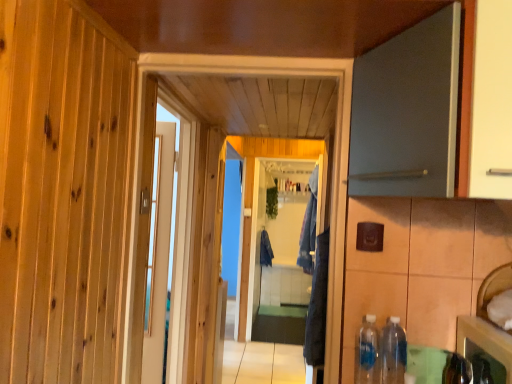
Question: Considering the relative sizes of shiny metallic cabinet at lower right and clear plastic bottle at lower right, the second bottle positioned from the left, in the image provided, is shiny metallic cabinet at lower right bigger than clear plastic bottle at lower right, the second bottle positioned from the left,?

Choices:
 (A) yes
 (B) no

Answer: (A)

Question: Does shiny metallic cabinet at lower right contain clear plastic bottle at lower right, which is the 1th bottle from right to left?

Choices:
 (A) no
 (B) yes

Answer: (A)

Question: Is shiny metallic cabinet at lower right far from clear plastic bottle at lower right, which is the 1th bottle from right to left?

Choices:
 (A) yes
 (B) no

Answer: (B)

Question: Can you confirm if shiny metallic cabinet at lower right is wider than clear plastic bottle at lower right, which is the 1th bottle from right to left?

Choices:
 (A) no
 (B) yes

Answer: (B)

Question: From the image's perspective, is shiny metallic cabinet at lower right above clear plastic bottle at lower right, which is the 1th bottle from right to left?

Choices:
 (A) no
 (B) yes

Answer: (B)

Question: Based on their positions, is clear plastic bottle at lower right, which is the 1th bottle from right to left, located to the left or right of clear glass screen door at center?

Choices:
 (A) left
 (B) right

Answer: (B)

Question: Is point (394, 352) positioned closer to the camera than point (271, 324)?

Choices:
 (A) farther
 (B) closer

Answer: (B)

Question: Considering their positions, is clear plastic bottle at lower right, which is the 1th bottle from right to left, located in front of or behind clear glass screen door at center?

Choices:
 (A) front
 (B) behind

Answer: (A)

Question: Do you think clear plastic bottle at lower right, which is the 1th bottle from right to left, is within clear glass screen door at center, or outside of it?

Choices:
 (A) inside
 (B) outside

Answer: (B)

Question: Looking at their shapes, would you say clear glass screen door at center is wider or thinner than matte gray door at upper right, positioned as the 2th door in back-to-front order?

Choices:
 (A) thin
 (B) wide

Answer: (A)

Question: Is point (264, 326) positioned closer to the camera than point (367, 188)?

Choices:
 (A) farther
 (B) closer

Answer: (A)

Question: Is clear glass screen door at center inside the boundaries of matte gray door at upper right, placed as the first door when sorted from right to left, or outside?

Choices:
 (A) inside
 (B) outside

Answer: (B)

Question: Considering the positions of clear glass screen door at center and matte gray door at upper right, placed as the first door when sorted from right to left, in the image, is clear glass screen door at center taller or shorter than matte gray door at upper right, placed as the first door when sorted from right to left,?

Choices:
 (A) short
 (B) tall

Answer: (B)

Question: From a real-world perspective, relative to white glossy door at center, which is counted as the 2th door, starting from the front, is blue fabric laundry at center, the second laundry in the back-to-front sequence, vertically above or below?

Choices:
 (A) below
 (B) above

Answer: (B)

Question: In the image, is blue fabric laundry at center, the second laundry in the back-to-front sequence, positioned in front of or behind white glossy door at center, the first door viewed from the back?

Choices:
 (A) front
 (B) behind

Answer: (B)